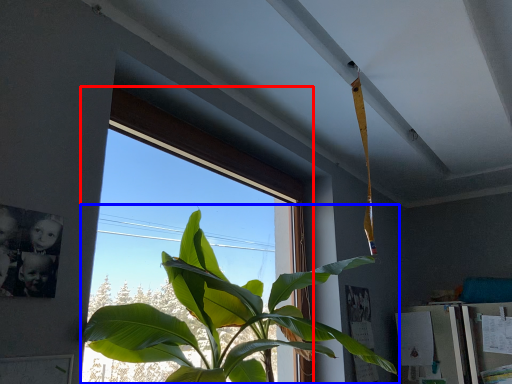
Question: Which object appears farthest to the camera in this image, window (highlighted by a red box) or houseplant (highlighted by a blue box)?

Choices:
 (A) window
 (B) houseplant

Answer: (A)